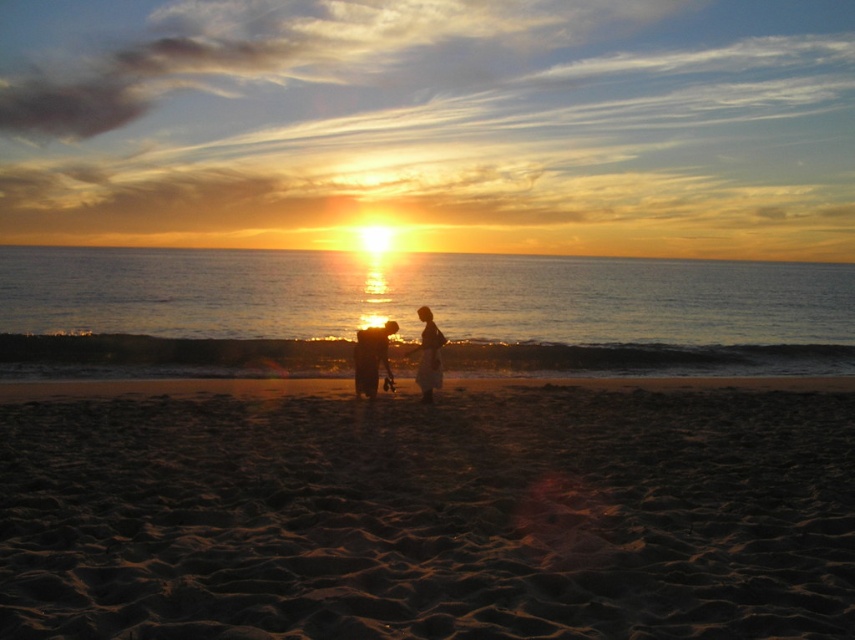
From the picture: You are a photographer trying to capture the sunset. You see the silhouette wooden couple at center and the silhouette sand at center in your viewfinder. Which object should you adjust your camera to focus on if you want to highlight the one that is positioned to the right?

You should focus on the silhouette wooden couple at center because it is positioned to the right of the silhouette sand at center.

You are a photographer trying to capture the sunset scene. You notice the silhouette sand at center and the silhouette fabric person at center. Which object should you focus on if you want to ensure the person is in the foreground of your photo?

The silhouette sand at center is located below the silhouette fabric person at center, so focusing on the silhouette fabric person at center will place them in the foreground since they are positioned higher in the frame.

You are a photographer trying to capture the sunset. You see the silhouette wooden couple at center and the silhouette sand at center in your viewfinder. Which object is closer to the camera?

The silhouette wooden couple at center is closer to the camera because it is in front of the silhouette sand at center.